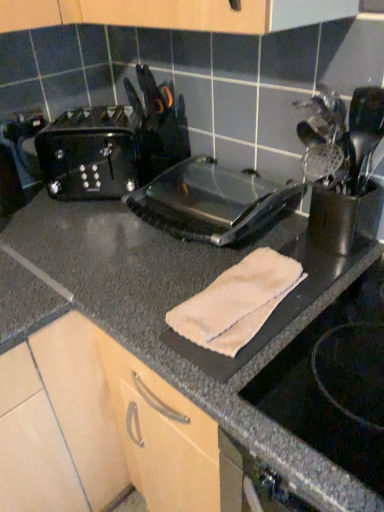
Question: From the image's perspective, is satin silver utensil holder at right located beneath black plastic toaster at left?

Choices:
 (A) no
 (B) yes

Answer: (B)

Question: Is satin silver utensil holder at right not within black plastic toaster at left?

Choices:
 (A) yes
 (B) no

Answer: (A)

Question: From the image's perspective, is satin silver utensil holder at right over black plastic toaster at left?

Choices:
 (A) yes
 (B) no

Answer: (B)

Question: Can you confirm if satin silver utensil holder at right is positioned to the right of black plastic toaster at left?

Choices:
 (A) no
 (B) yes

Answer: (B)

Question: Is satin silver utensil holder at right facing towards black plastic toaster at left?

Choices:
 (A) no
 (B) yes

Answer: (A)

Question: Does satin silver utensil holder at right lie in front of black plastic toaster at left?

Choices:
 (A) yes
 (B) no

Answer: (A)

Question: Is beige cotton towel at center at the left side of black plastic toaster at left?

Choices:
 (A) yes
 (B) no

Answer: (B)

Question: Can you confirm if beige cotton towel at center is shorter than black plastic toaster at left?

Choices:
 (A) yes
 (B) no

Answer: (A)

Question: From a real-world perspective, is beige cotton towel at center located higher than black plastic toaster at left?

Choices:
 (A) yes
 (B) no

Answer: (B)

Question: From the image's perspective, is beige cotton towel at center over black plastic toaster at left?

Choices:
 (A) no
 (B) yes

Answer: (A)

Question: Considering the relative positions of beige cotton towel at center and black plastic toaster at left in the image provided, is beige cotton towel at center to the right of black plastic toaster at left from the viewer's perspective?

Choices:
 (A) yes
 (B) no

Answer: (A)

Question: Considering the relative sizes of beige cotton towel at center and black plastic toaster at left in the image provided, is beige cotton towel at center wider than black plastic toaster at left?

Choices:
 (A) yes
 (B) no

Answer: (A)

Question: Is black plastic toaster at left thinner than satin silver utensil holder at right?

Choices:
 (A) no
 (B) yes

Answer: (A)